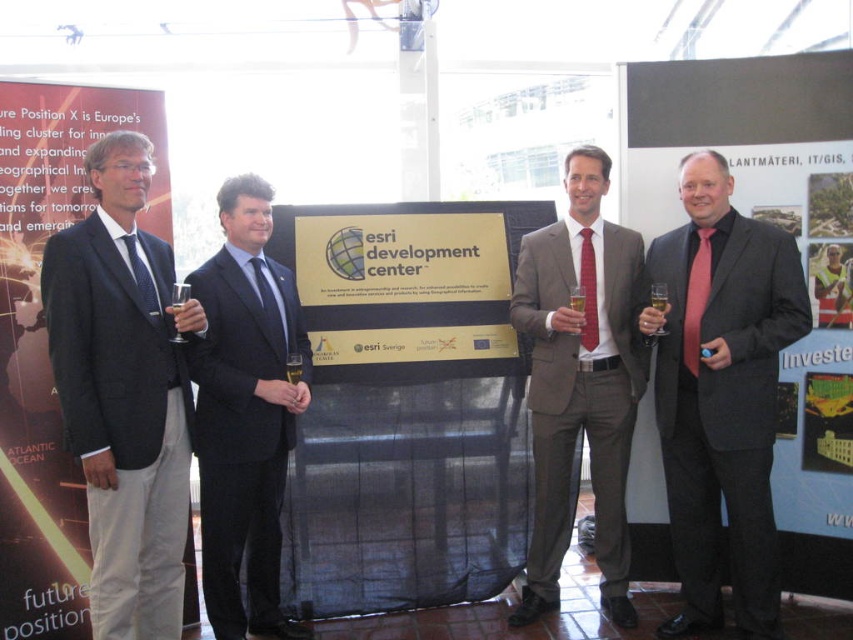
You are an event photographer at a corporate event. You need to capture a photo of the dark gray suit at left and the matte gray suit at center. Which suit has a narrower lapel?

The dark gray suit at left has a narrower lapel because it is thinner than the matte gray suit at center.

You are a photographer at the event and want to capture a clear photo of the dark gray suit at left and the matte gray suit at center. Which suit will appear more in front in the photo?

The dark gray suit at left is positioned over matte gray suit at center, so it will appear more in front in the photo.